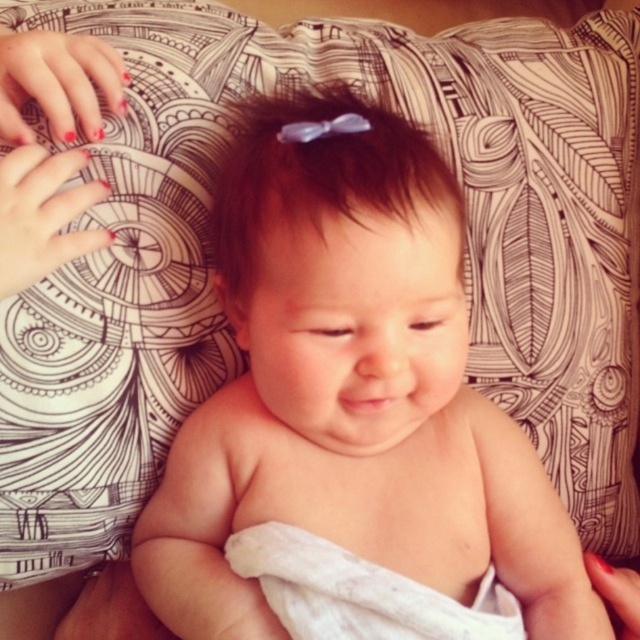
In the scene shown: Between smooth skin baby at center and white cloth diaper at center, which one appears on the right side from the viewer's perspective?

white cloth diaper at center is more to the right.

Does smooth skin baby at center appear over white cloth diaper at center?

Yes.

Is point (429, 177) less distant than point (515, 609)?

Yes, point (429, 177) is in front of point (515, 609).

You are a GUI agent. You are given a task and a screenshot of the screen. Output one action in this format:
    pyautogui.click(x=<x>, y=<y>)
    Task: Click on the smooth skin baby at center
    
    Given the screenshot: What is the action you would take?
    pyautogui.click(x=353, y=416)

Who is more distant from viewer, (232,269) or (403,612)?

Positioned behind is point (232,269).

Which of these two, brown matte hair bow at center or white cloth diaper at center, stands shorter?

white cloth diaper at center

Who is more forward, (230, 209) or (301, 556)?

Point (301, 556) is in front.

The width and height of the screenshot is (640, 640). I want to click on brown matte hair bow at center, so click(317, 177).

Is smooth skin baby at center further to camera compared to brown matte hair bow at center?

Yes.

Does smooth skin baby at center have a greater width compared to brown matte hair bow at center?

Indeed, smooth skin baby at center has a greater width compared to brown matte hair bow at center.

Who is more forward, (392, 168) or (403, 161)?

Positioned in front is point (392, 168).

Locate an element on the screen. smooth skin baby at center is located at coordinates (353, 416).